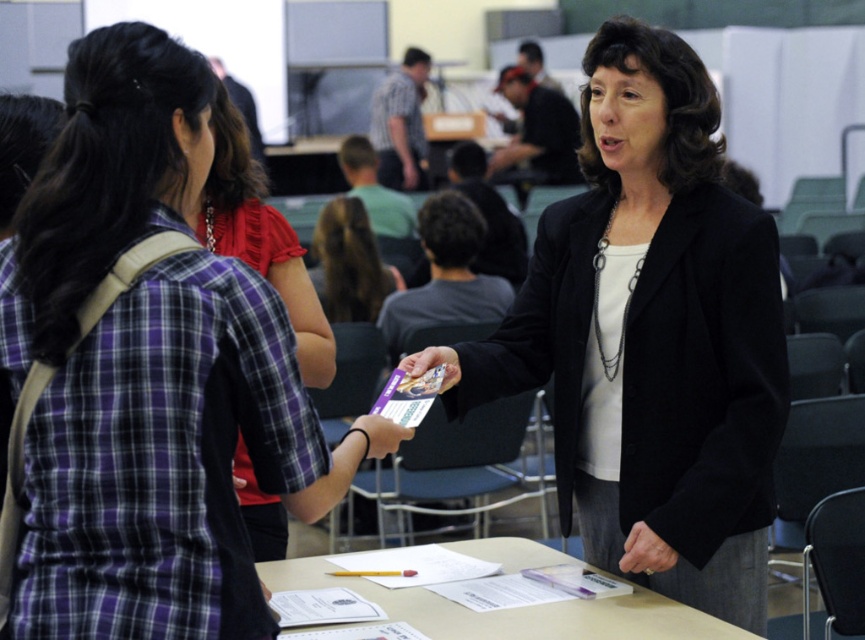
Question: Can you confirm if black matte blazer at center is positioned to the left of smooth beige table at center?

Choices:
 (A) yes
 (B) no

Answer: (B)

Question: Among these points, which one is nearest to the camera?

Choices:
 (A) (392, 284)
 (B) (177, 552)
 (C) (580, 602)

Answer: (B)

Question: Which point is farther from the camera taking this photo?

Choices:
 (A) (334, 480)
 (B) (236, 211)

Answer: (B)

Question: Does smooth beige table at center have a greater width compared to plaid fabric shirt at center?

Choices:
 (A) no
 (B) yes

Answer: (B)

Question: Which object appears farthest from the camera in this image?

Choices:
 (A) plaid fabric shirt at center
 (B) brown hair at center
 (C) matte black blazer at center

Answer: (B)

Question: Is plaid fabric shirt at center thinner than brown hair at center?

Choices:
 (A) no
 (B) yes

Answer: (B)